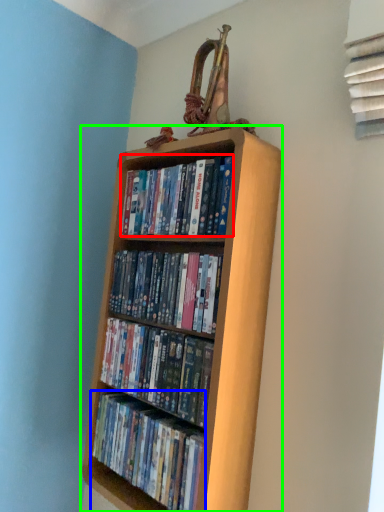
Question: Estimate the real-world distances between objects in this image. Which object is closer to book (highlighted by a red box), book (highlighted by a blue box) or bookcase (highlighted by a green box)?

Choices:
 (A) book
 (B) bookcase

Answer: (B)